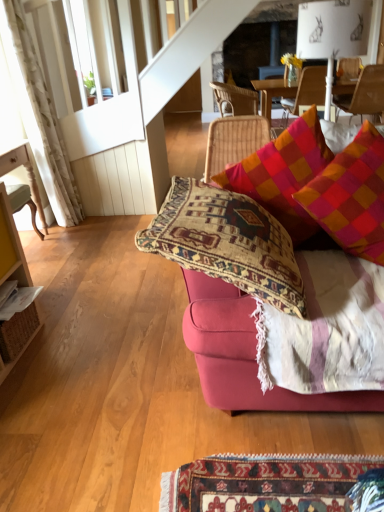
Question: Could you tell me if wooden chair at left, which ranks as the fourth chair in back-to-front order, is turned towards wooden chair at upper right, acting as the second chair starting from the front?

Choices:
 (A) yes
 (B) no

Answer: (B)

Question: Would you say wooden chair at left, the first chair in the front-to-back sequence, contains wooden chair at upper right, which is the first chair from right to left?

Choices:
 (A) no
 (B) yes

Answer: (A)

Question: Considering the relative sizes of wooden chair at left, the first chair in the front-to-back sequence, and wooden chair at upper right, acting as the second chair starting from the front, in the image provided, is wooden chair at left, the first chair in the front-to-back sequence, shorter than wooden chair at upper right, acting as the second chair starting from the front,?

Choices:
 (A) no
 (B) yes

Answer: (B)

Question: Is the depth of wooden chair at left, the 4th chair viewed from the right, greater than that of wooden chair at upper right, acting as the second chair starting from the front?

Choices:
 (A) yes
 (B) no

Answer: (B)

Question: Is wooden chair at left, which ranks as the fourth chair in back-to-front order, at the left side of wooden chair at upper right, which is the first chair from right to left?

Choices:
 (A) no
 (B) yes

Answer: (B)

Question: Considering the relative sizes of wooden chair at left, which ranks as the fourth chair in back-to-front order, and wooden chair at upper right, which is the fourth chair in left-to-right order, in the image provided, is wooden chair at left, which ranks as the fourth chair in back-to-front order, taller than wooden chair at upper right, which is the fourth chair in left-to-right order,?

Choices:
 (A) yes
 (B) no

Answer: (B)

Question: Can you confirm if plaid fabric pillow at upper right, positioned as the 1th pillow in right-to-left order, is smaller than multicolored woven cushion at upper right, which is the first pillow from left to right?

Choices:
 (A) no
 (B) yes

Answer: (B)

Question: Is plaid fabric pillow at upper right, the 2th pillow positioned from the left, not inside multicolored woven cushion at upper right, acting as the 2th pillow starting from the right?

Choices:
 (A) no
 (B) yes

Answer: (B)

Question: Is plaid fabric pillow at upper right, positioned as the 1th pillow in right-to-left order, oriented away from multicolored woven cushion at upper right, acting as the 2th pillow starting from the right?

Choices:
 (A) no
 (B) yes

Answer: (B)

Question: From the image's perspective, is plaid fabric pillow at upper right, positioned as the 1th pillow in right-to-left order, on multicolored woven cushion at upper right, acting as the 2th pillow starting from the right?

Choices:
 (A) no
 (B) yes

Answer: (A)

Question: Can you confirm if plaid fabric pillow at upper right, positioned as the 1th pillow in right-to-left order, is positioned to the right of multicolored woven cushion at upper right, acting as the 2th pillow starting from the right?

Choices:
 (A) no
 (B) yes

Answer: (B)

Question: From a real-world perspective, is plaid fabric pillow at upper right, the 2th pillow positioned from the left, under multicolored woven cushion at upper right, acting as the 2th pillow starting from the right?

Choices:
 (A) yes
 (B) no

Answer: (A)

Question: Is wooden chair at upper right, positioned as the second chair in back-to-front order, positioned in front of multicolored woven cushion at upper right, which is the first pillow from left to right?

Choices:
 (A) no
 (B) yes

Answer: (A)